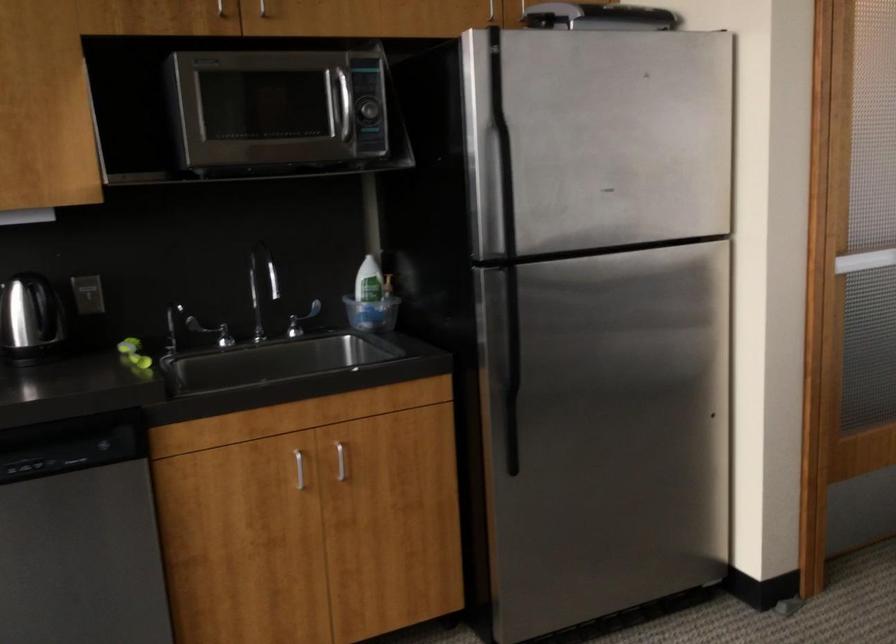
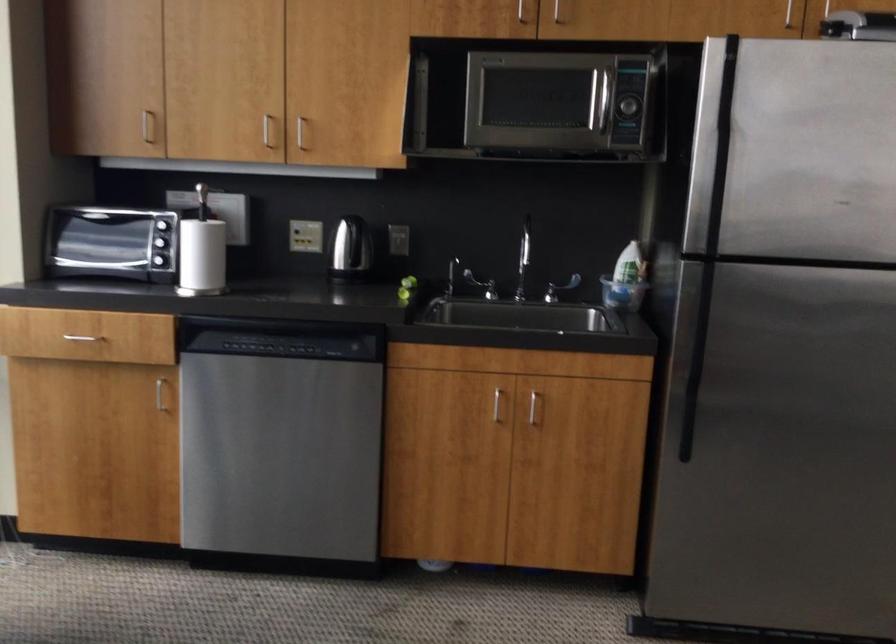
Locate, in the second image, the point that corresponds to (510,185) in the first image.

(718, 184)